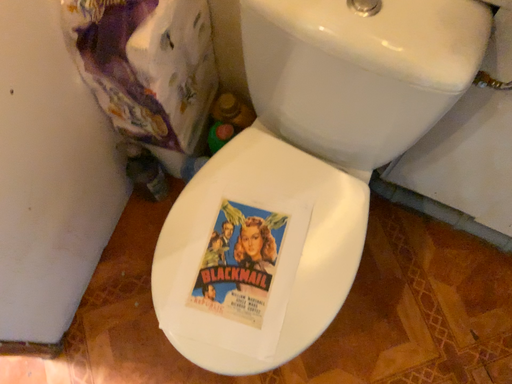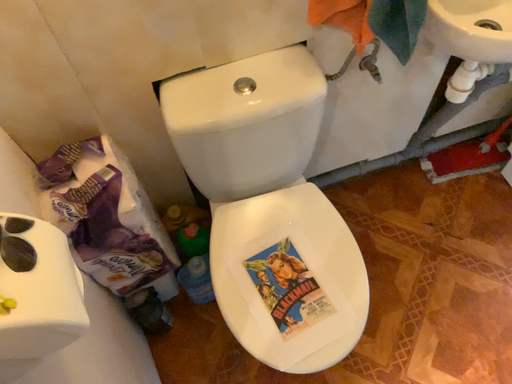
Question: How did the camera likely rotate when shooting the video?

Choices:
 (A) rotated right
 (B) rotated left

Answer: (A)